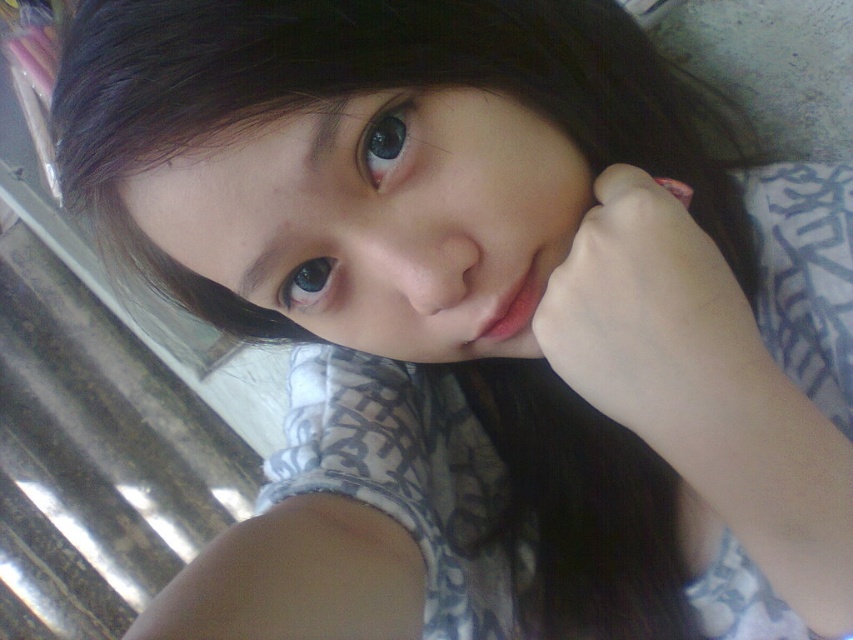
You are a photographer trying to adjust the lighting for a portrait. The subject is lying down with their head resting on their hand. You need to place a reflector to highlight the pale skin and hair at the cheek area. According to the coordinates provided, where should you position the reflector relative to the subject to best illuminate the pale skin and hair at the cheek area represented by point (653,320)?

The pale skin and hair at the cheek represented by point (653,320) is located at the center horizontally and lower two thirds vertically. To best illuminate this area, position the reflector below and slightly to the side of the subject to bounce light upwards towards the cheek area.

You are a photographer adjusting your camera to focus on two points in the image. The first point is point (x=485, y=352) and the second is point (x=300, y=298). Which point is closer to your camera lens?

Point (x=485, y=352) is further to the viewer than point (x=300, y=298), so the second point is closer to the camera lens.